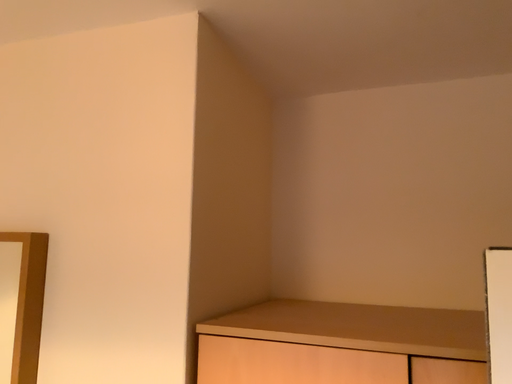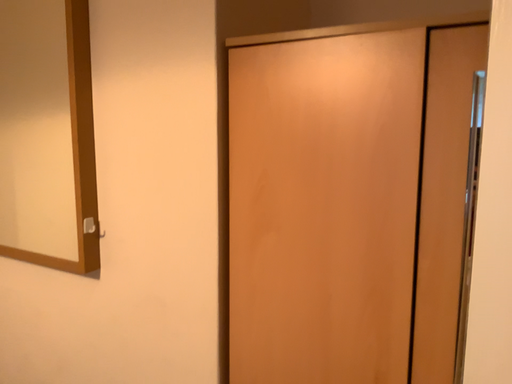
Question: Which way did the camera rotate in the video?

Choices:
 (A) rotated right
 (B) rotated left

Answer: (B)